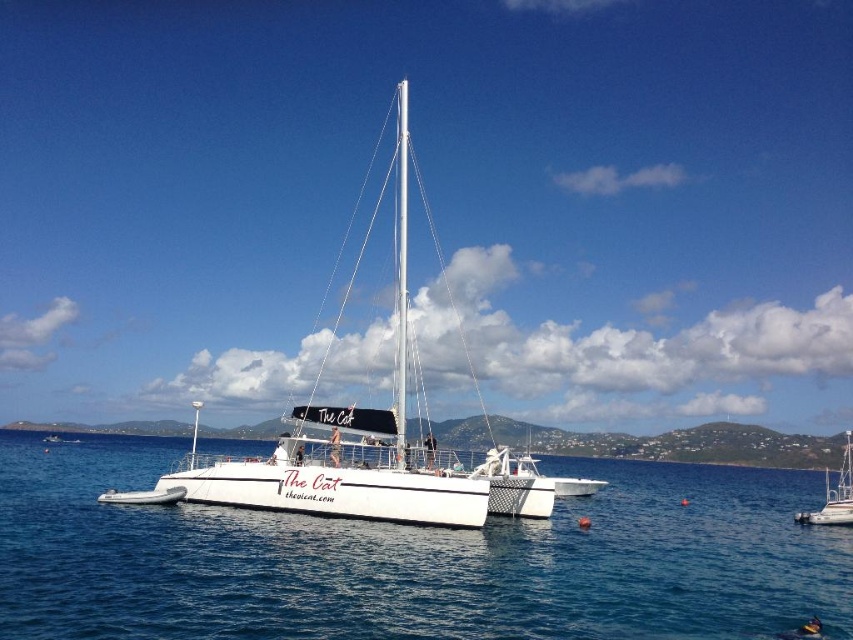
Question: Is the position of white water at center less distant than that of white matte sailboat at lower right?

Choices:
 (A) yes
 (B) no

Answer: (A)

Question: Can you confirm if white water at center is positioned to the left of white matte sailboat at lower right?

Choices:
 (A) yes
 (B) no

Answer: (A)

Question: Does white water at center appear on the left side of white matte sailboat at lower right?

Choices:
 (A) no
 (B) yes

Answer: (B)

Question: Among these points, which one is nearest to the camera?

Choices:
 (A) (654, 636)
 (B) (824, 524)

Answer: (A)